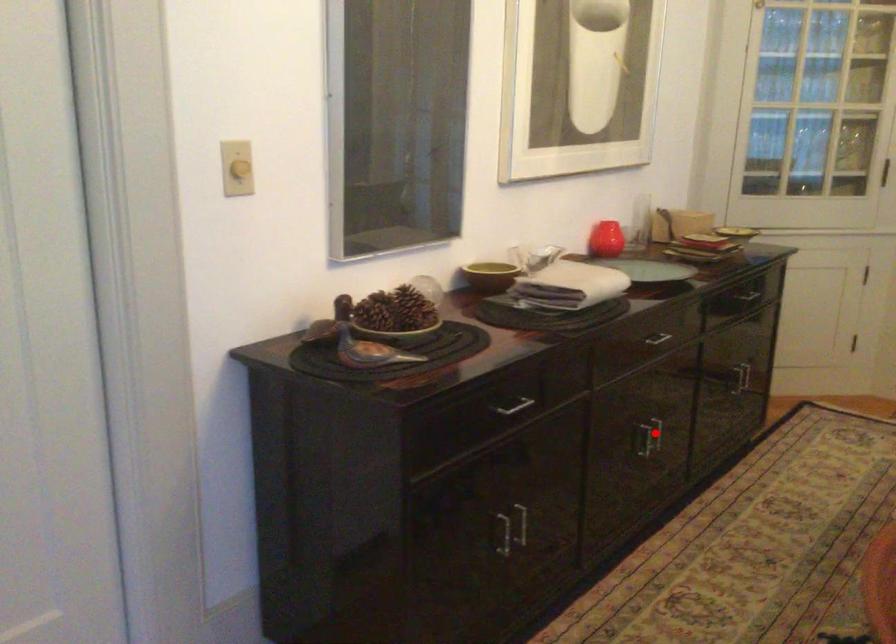
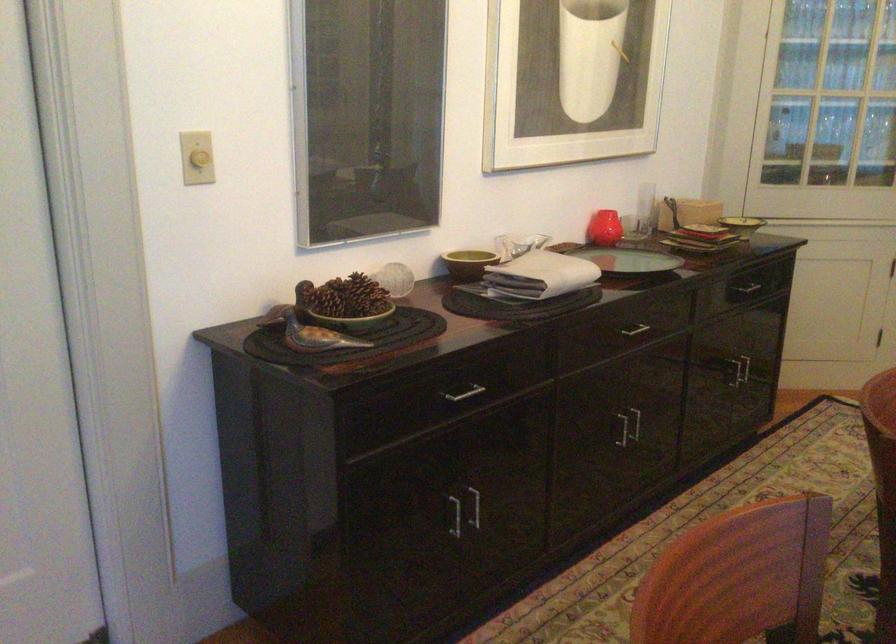
In the second image, find the point that corresponds to the highlighted location in the first image.

(635, 422)